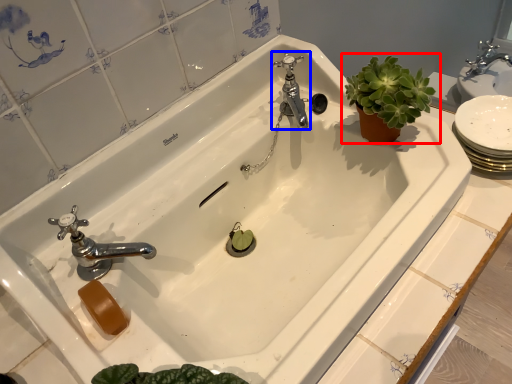
Question: Which point is further to the camera, houseplant (highlighted by a red box) or tap (highlighted by a blue box)?

Choices:
 (A) houseplant
 (B) tap

Answer: (B)